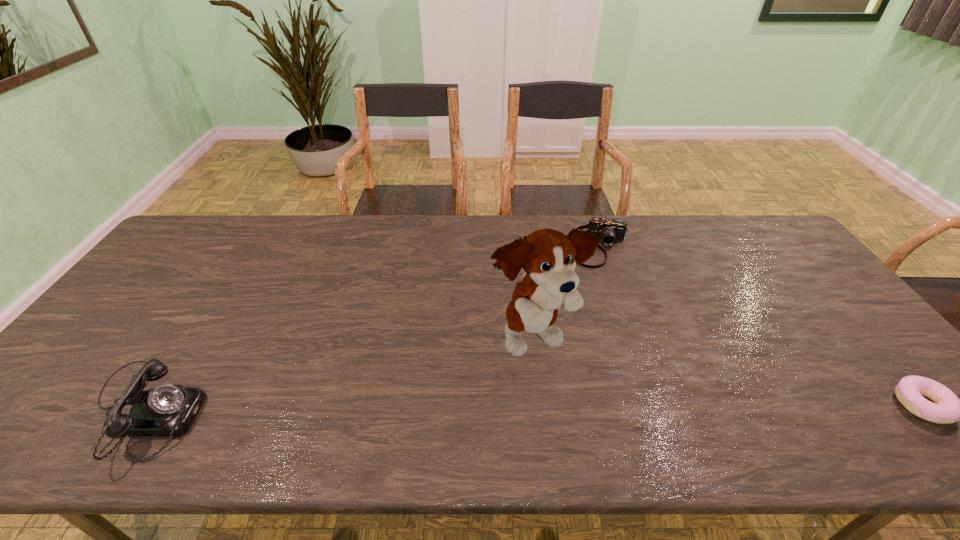
Where is `the third shortest object`? The height and width of the screenshot is (540, 960). the third shortest object is located at coordinates (166, 410).

You are a GUI agent. You are given a task and a screenshot of the screen. Output one action in this format:
    pyautogui.click(x=<x>, y=<y>)
    Task: Click on the telephone
    
    Given the screenshot: What is the action you would take?
    pyautogui.click(x=166, y=410)

The image size is (960, 540). I want to click on the third object from left to right, so click(x=609, y=230).

Locate an element on the screen. camera is located at coordinates (609, 230).

I want to click on the second object from left to right, so click(548, 257).

Identify the location of puppy. (548, 257).

Where is `vacant space positioned on the front-facing side of the second tallest object`? This screenshot has height=540, width=960. vacant space positioned on the front-facing side of the second tallest object is located at coordinates (337, 411).

The height and width of the screenshot is (540, 960). Identify the location of free space located 0.180m on the front-facing side of the third object from left to right. (589, 306).

Locate an element on the screen. The image size is (960, 540). blank space located 0.050m on the front-facing side of the third object from left to right is located at coordinates click(594, 278).

Where is `vacant space located 0.360m on the front-facing side of the third object from left to right`? Image resolution: width=960 pixels, height=540 pixels. vacant space located 0.360m on the front-facing side of the third object from left to right is located at coordinates coord(584,354).